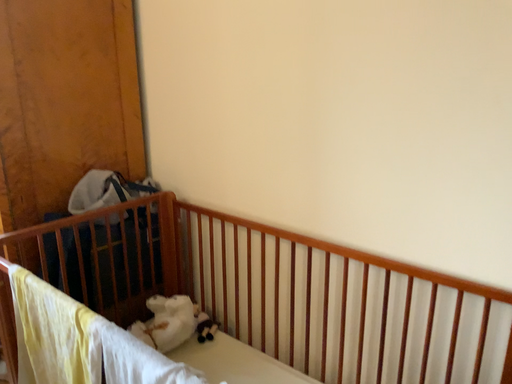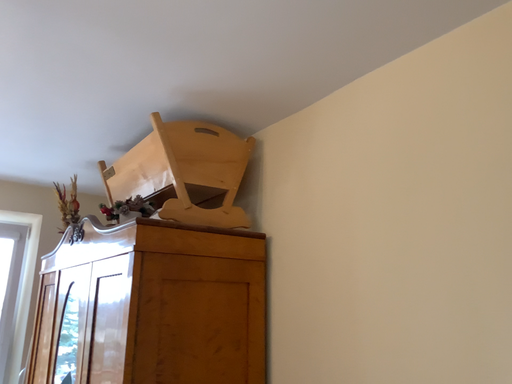
Question: Which way did the camera rotate in the video?

Choices:
 (A) rotated upward
 (B) rotated downward

Answer: (A)